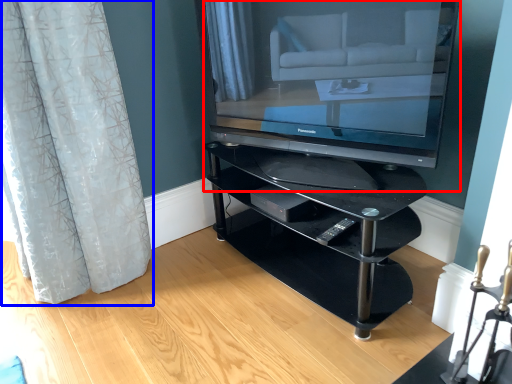
Question: Which object appears closest to the camera in this image, television (highlighted by a red box) or curtain (highlighted by a blue box)?

Choices:
 (A) television
 (B) curtain

Answer: (A)